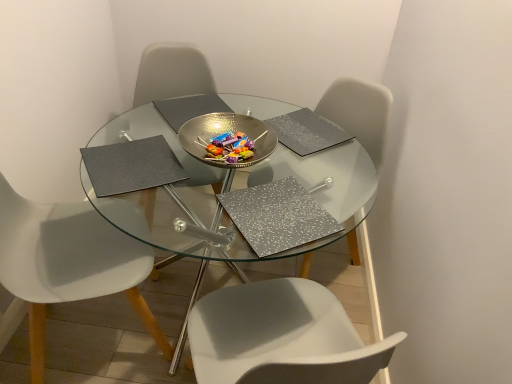
Question: Considering the relative positions of transparent glass table at center and metallic bowl at center in the image provided, is transparent glass table at center behind metallic bowl at center?

Choices:
 (A) no
 (B) yes

Answer: (A)

Question: Does transparent glass table at center have a smaller size compared to metallic bowl at center?

Choices:
 (A) no
 (B) yes

Answer: (A)

Question: Does transparent glass table at center have a lesser width compared to metallic bowl at center?

Choices:
 (A) yes
 (B) no

Answer: (B)

Question: Is transparent glass table at center bigger than metallic bowl at center?

Choices:
 (A) no
 (B) yes

Answer: (B)

Question: Can metallic bowl at center be found inside transparent glass table at center?

Choices:
 (A) no
 (B) yes

Answer: (A)

Question: From the image's perspective, is white plastic chair at center, which is the second chair from right to left, above or below white plastic chair at left, the first chair positioned from the left?

Choices:
 (A) below
 (B) above

Answer: (B)

Question: Is white plastic chair at center, which is the second chair from right to left, spatially inside white plastic chair at left, the first chair positioned from the left, or outside of it?

Choices:
 (A) inside
 (B) outside

Answer: (B)

Question: Considering the positions of white plastic chair at center, which is the second chair from right to left, and white plastic chair at left, the first chair positioned from the left, in the image, is white plastic chair at center, which is the second chair from right to left, wider or thinner than white plastic chair at left, the first chair positioned from the left,?

Choices:
 (A) wide
 (B) thin

Answer: (B)

Question: Considering the positions of white plastic chair at center, which is the second chair from right to left, and white plastic chair at left, the third chair when ordered from right to left, in the image, is white plastic chair at center, which is the second chair from right to left, bigger or smaller than white plastic chair at left, the third chair when ordered from right to left,?

Choices:
 (A) big
 (B) small

Answer: (B)

Question: Based on their sizes in the image, would you say metallic bowl at center is bigger or smaller than gray matte placemat at upper left, the first pad when ordered from left to right?

Choices:
 (A) big
 (B) small

Answer: (A)

Question: From a real-world perspective, is metallic bowl at center physically located above or below gray matte placemat at upper left, which is counted as the third pad, starting from the right?

Choices:
 (A) above
 (B) below

Answer: (A)

Question: In terms of width, does metallic bowl at center look wider or thinner when compared to gray matte placemat at upper left, the first pad when ordered from left to right?

Choices:
 (A) thin
 (B) wide

Answer: (B)

Question: From their relative heights in the image, would you say metallic bowl at center is taller or shorter than gray matte placemat at upper left, which is counted as the third pad, starting from the right?

Choices:
 (A) short
 (B) tall

Answer: (B)

Question: Relative to white plastic chair at left, the first chair positioned from the left, is silver textured pad at upper center, the 1th pad from the right, in front or behind?

Choices:
 (A) behind
 (B) front

Answer: (A)

Question: Considering the positions of silver textured pad at upper center, the 1th pad from the right, and white plastic chair at left, the third chair when ordered from right to left, in the image, is silver textured pad at upper center, the 1th pad from the right, wider or thinner than white plastic chair at left, the third chair when ordered from right to left,?

Choices:
 (A) thin
 (B) wide

Answer: (A)